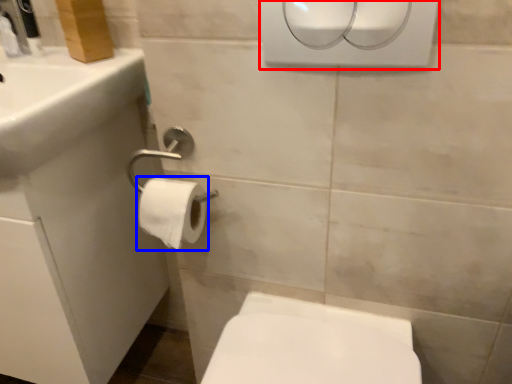
Question: Which object appears closest to the camera in this image, hand dryer (highlighted by a red box) or toilet paper (highlighted by a blue box)?

Choices:
 (A) hand dryer
 (B) toilet paper

Answer: (A)